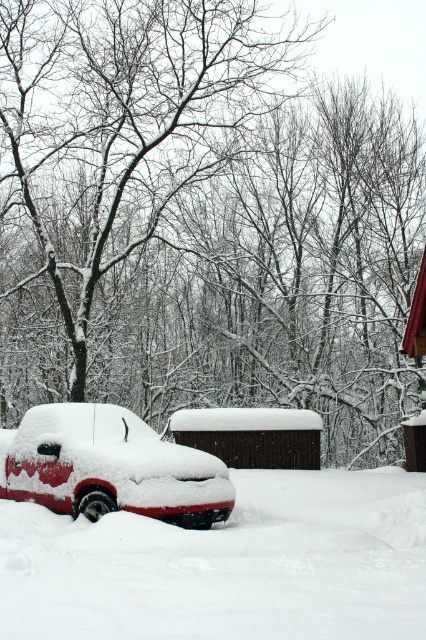
You are standing at the point marked as point (204, 220) in the image. What object is directly in front of you?

The point (204, 220) corresponds to the snow covered tree at center, so the snow covered tree at center is directly in front of you.